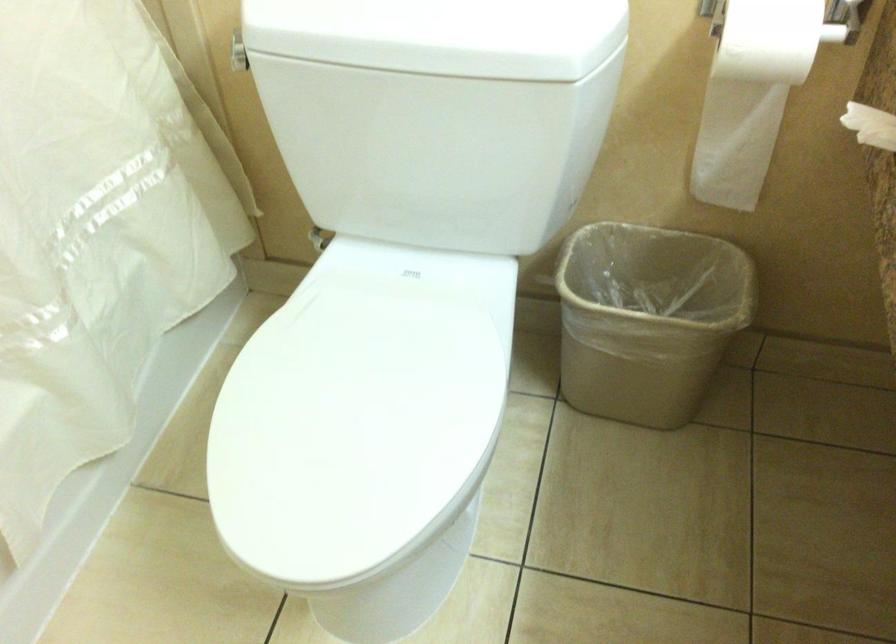
Where is `white toilet lid`? white toilet lid is located at coordinates (393, 35).